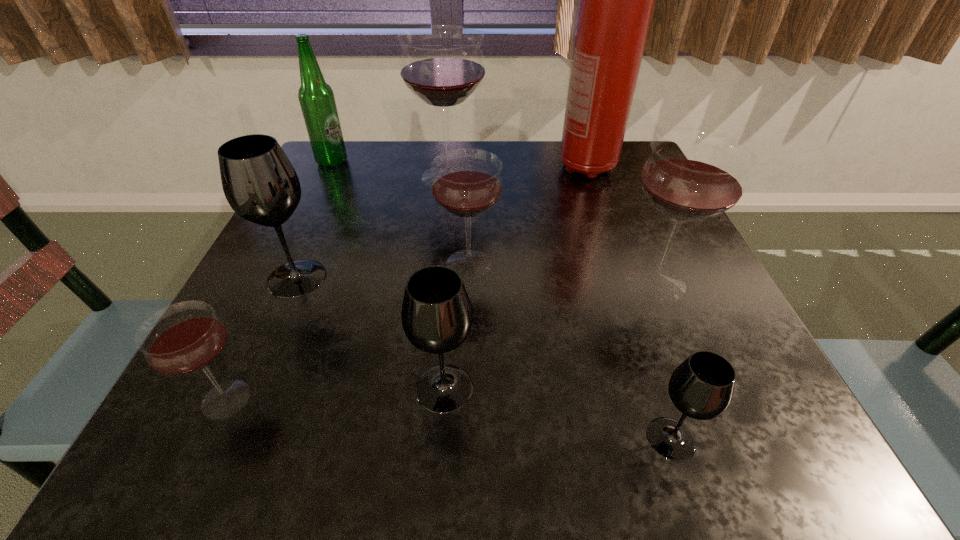
The image size is (960, 540). In order to click on blank area located on the right of the second smallest red wineglass in this screenshot , I will do click(693, 264).

This screenshot has width=960, height=540. Find the location of `free space located 0.250m on the right of the second nearest gray wineglass`. free space located 0.250m on the right of the second nearest gray wineglass is located at coordinates (650, 388).

At what (x,y) coordinates should I click in order to perform the action: click on vacant space located on the back of the nearest red wineglass. Please return your answer as a coordinate pair (x, y). The height and width of the screenshot is (540, 960). Looking at the image, I should click on (308, 226).

Locate an element on the screen. Image resolution: width=960 pixels, height=540 pixels. free space located on the back of the rightmost gray wineglass is located at coordinates (651, 379).

Find the location of a particular element. Image resolution: width=960 pixels, height=540 pixels. fire extinguisher present at the far edge is located at coordinates (616, 4).

Identify the location of wineglass that is at the far edge. This screenshot has height=540, width=960. (442, 65).

I want to click on beer bottle present at the far edge, so click(x=316, y=97).

Find the location of `beer bottle that is positioned at the left edge`. beer bottle that is positioned at the left edge is located at coordinates (316, 97).

At what (x,y) coordinates should I click in order to perform the action: click on fire extinguisher that is at the right edge. Please return your answer as a coordinate pair (x, y). Looking at the image, I should click on (616, 4).

Locate an element on the screen. The height and width of the screenshot is (540, 960). object that is at the far left corner is located at coordinates (316, 97).